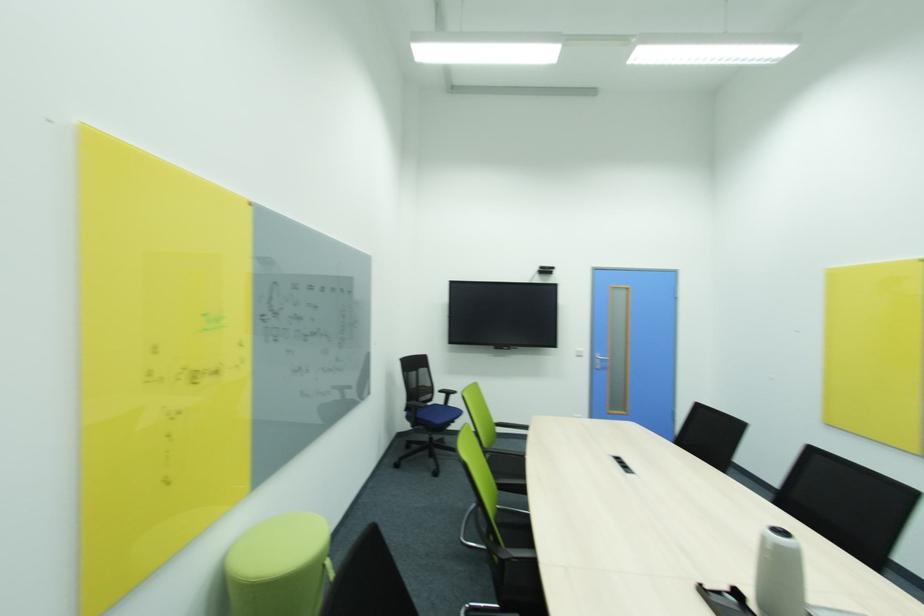
Where would you sit the blue chair sitting surface? Please return your answer as a coordinate pair (x, y).

(424, 410)